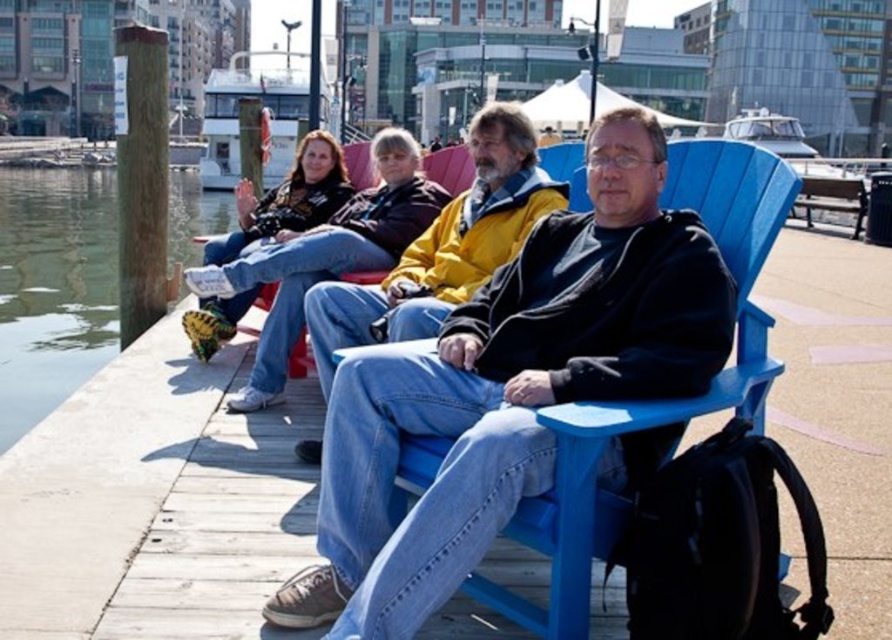
In the scene shown: You are standing at the entrance of the waterfront promenade and want to locate the matte black jacket at center. According to the coordinates provided, where should you look relative to the scene?

The matte black jacket at center is located at coordinates point [508,388], which means it is positioned approximately two thirds of the way from the left edge and slightly below the center vertically in the scene.

You are planning to place a small picnic basket between the clear water at dock left and the yellow matte jacket at center. Considering their sizes, which object should the basket be closer to?

The clear water at dock left is wider than the yellow matte jacket at center. Therefore, the picnic basket should be placed closer to the yellow matte jacket at center to ensure it fits within the narrower space.

You are standing at the point labeled as point (534,492) and want to take a photo of the waterfront promenade. The camera you have can focus on objects within 7 meters. Will the camera be able to capture the entire scene clearly?

The distance between you and the viewer is 6.84 meters, which is within the camera focus range of 7 meters. Therefore, the camera can capture the entire scene clearly.